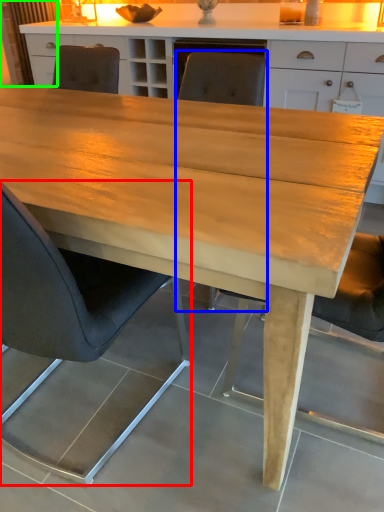
Question: Estimate the real-world distances between objects in this image. Which object is closer to chair (highlighted by a red box), chair (highlighted by a blue box) or curtain (highlighted by a green box)?

Choices:
 (A) chair
 (B) curtain

Answer: (A)